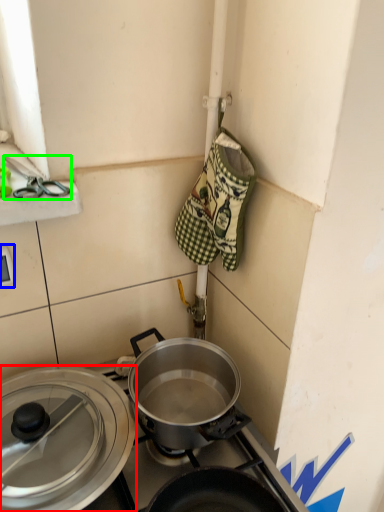
Question: Based on their relative distances, which object is nearer to pot/pan (highlighted by a red box)? Choose from electric outlet (highlighted by a blue box) and scissors (highlighted by a green box).

Choices:
 (A) electric outlet
 (B) scissors

Answer: (A)